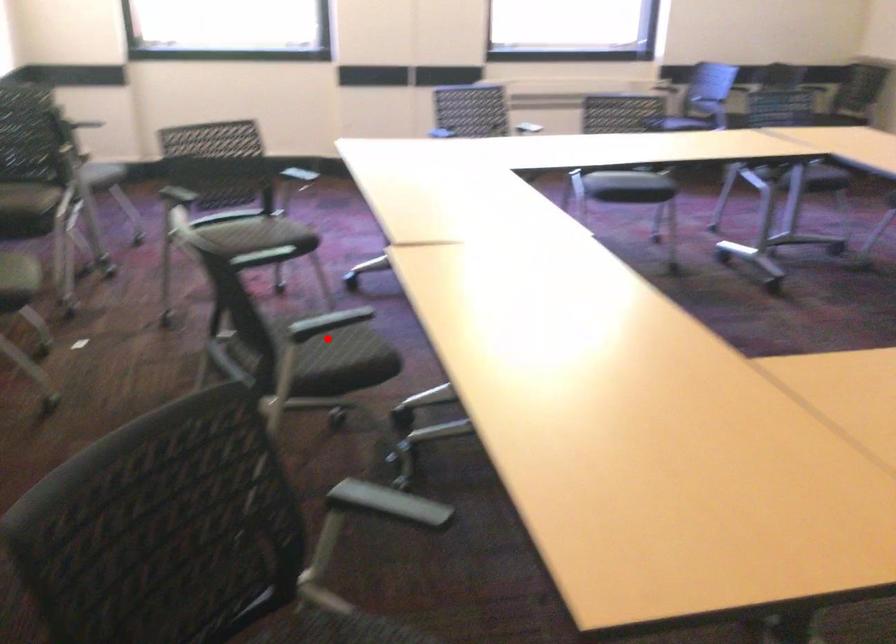
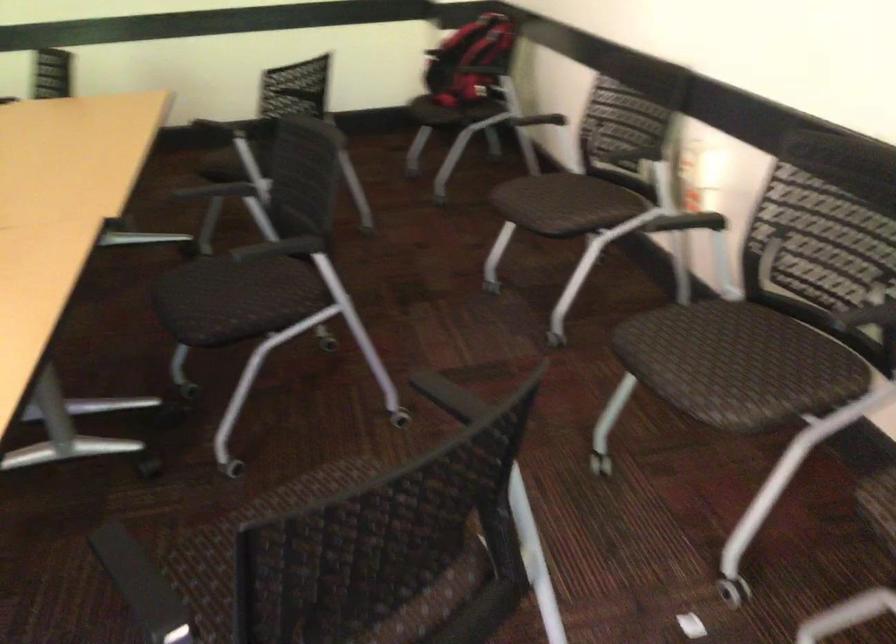
Question: A red point is marked in image1. In image2, is the corresponding 3D point closer to the camera or farther? Reply with the corresponding letter.

Choices:
 (A) The corresponding 3D point is closer.
 (B) The corresponding 3D point is farther.

Answer: (A)